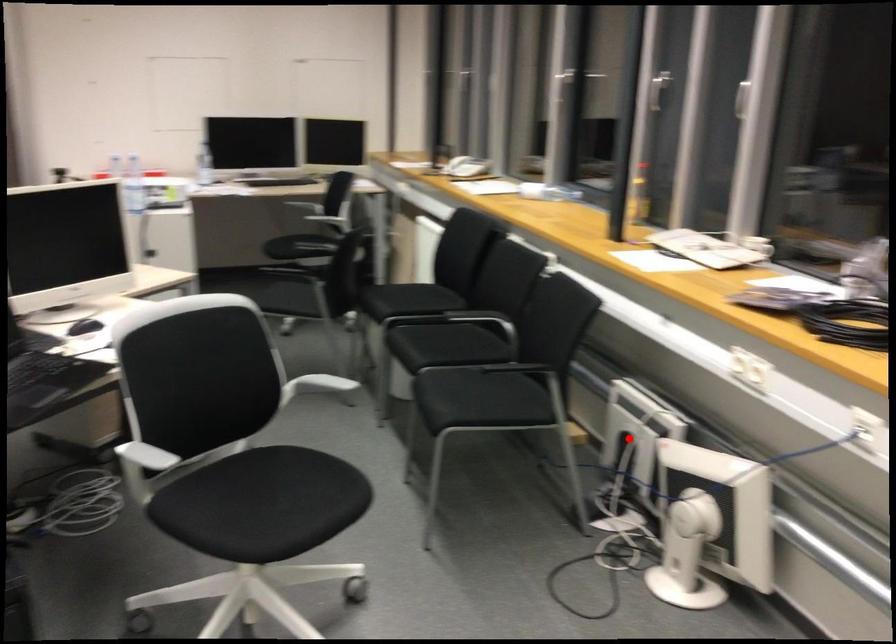
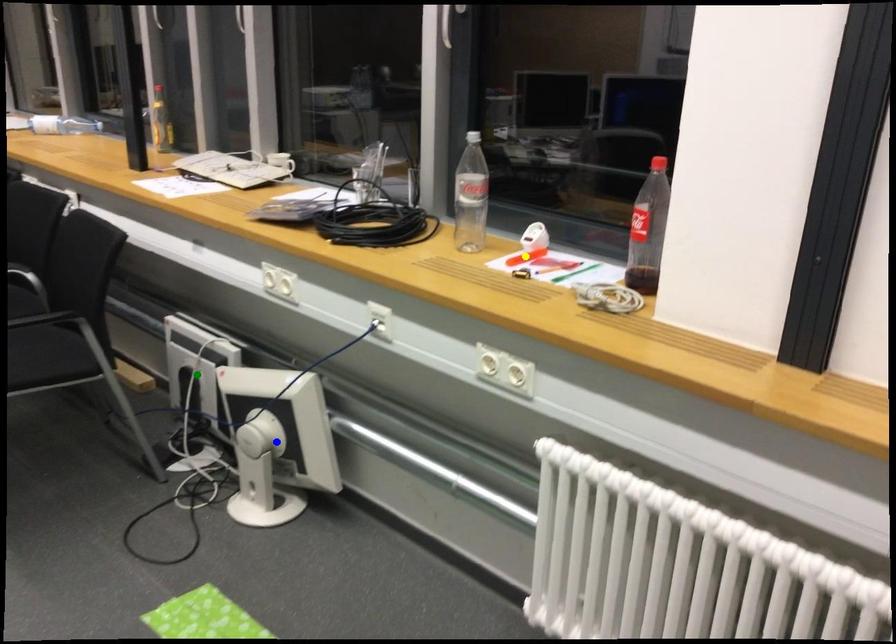
Question: I am providing you with two images of the same scene from different viewpoints. A red point is marked on the first image. You are given multiple points on the second image. Which mark in image 2 goes with the point in image 1?

Choices:
 (A) blue point
 (B) yellow point
 (C) green point

Answer: (C)